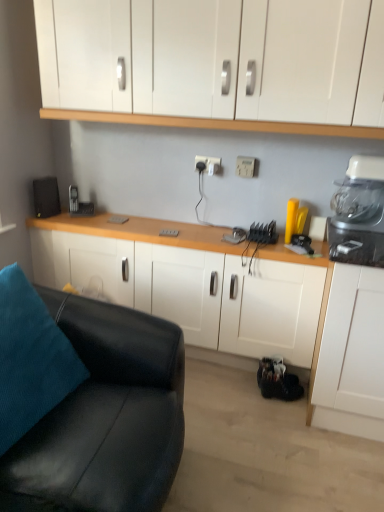
Question: Is white plastic electric outlet at center, acting as the first electric outlet starting from the right, positioned beyond the bounds of black leather couch at lower left?

Choices:
 (A) no
 (B) yes

Answer: (B)

Question: Is white plastic electric outlet at center, acting as the first electric outlet starting from the right, oriented towards black leather couch at lower left?

Choices:
 (A) yes
 (B) no

Answer: (B)

Question: Are white plastic electric outlet at center, which appears as the 2th electric outlet when viewed from the left, and black leather couch at lower left far apart?

Choices:
 (A) yes
 (B) no

Answer: (A)

Question: Would you say black leather couch at lower left is part of white plastic electric outlet at center, acting as the first electric outlet starting from the right,'s contents?

Choices:
 (A) no
 (B) yes

Answer: (A)

Question: From the image's perspective, does white plastic electric outlet at center, which appears as the 2th electric outlet when viewed from the left, appear lower than black leather couch at lower left?

Choices:
 (A) no
 (B) yes

Answer: (A)

Question: From a real-world perspective, relative to black leather couch at lower left, is white plastic electric outlet at center, which appears as the second electric outlet when viewed from the right, vertically above or below?

Choices:
 (A) above
 (B) below

Answer: (A)

Question: Is white plastic electric outlet at center, the first electric outlet when ordered from left to right, to the left or to the right of black leather couch at lower left in the image?

Choices:
 (A) right
 (B) left

Answer: (A)

Question: Is white plastic electric outlet at center, which appears as the second electric outlet when viewed from the right, in front of or behind black leather couch at lower left in the image?

Choices:
 (A) front
 (B) behind

Answer: (B)

Question: Is white plastic electric outlet at center, which appears as the second electric outlet when viewed from the right, wider or thinner than black leather couch at lower left?

Choices:
 (A) wide
 (B) thin

Answer: (B)

Question: In terms of height, does white plastic blender at upper right look taller or shorter compared to teal fabric pillow at lower left?

Choices:
 (A) short
 (B) tall

Answer: (A)

Question: Would you say white plastic blender at upper right is inside or outside teal fabric pillow at lower left?

Choices:
 (A) inside
 (B) outside

Answer: (B)

Question: Visually, is white plastic blender at upper right positioned to the left or to the right of teal fabric pillow at lower left?

Choices:
 (A) left
 (B) right

Answer: (B)

Question: Is white plastic blender at upper right wider or thinner than teal fabric pillow at lower left?

Choices:
 (A) thin
 (B) wide

Answer: (A)

Question: Is white matte cabinet at center, positioned as the second cabinetry in top-to-bottom order, bigger or smaller than black leather couch at lower left?

Choices:
 (A) small
 (B) big

Answer: (A)

Question: From a real-world perspective, is white matte cabinet at center, positioned as the second cabinetry in top-to-bottom order, positioned above or below black leather couch at lower left?

Choices:
 (A) above
 (B) below

Answer: (B)